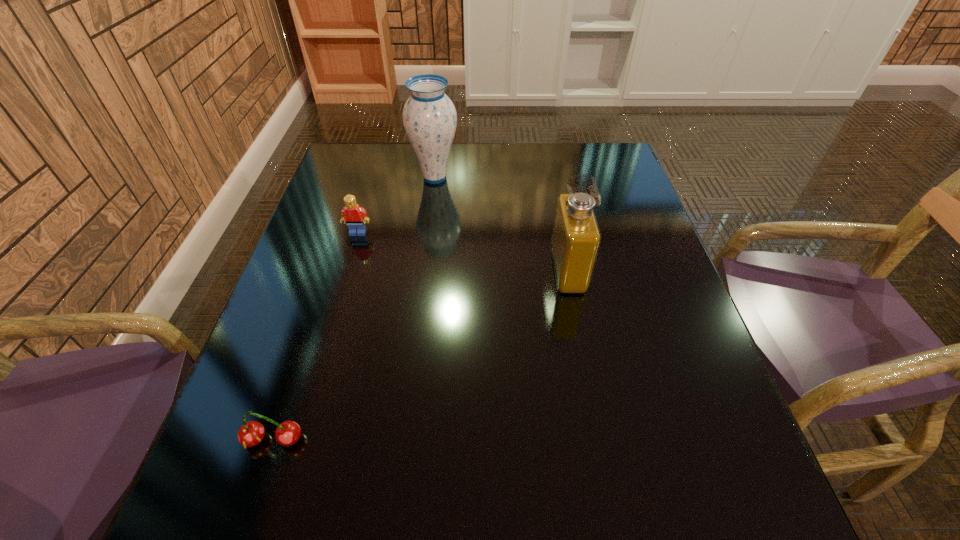
I want to click on the farthest object, so click(429, 117).

Locate an element on the screen. the second object from right to left is located at coordinates (429, 117).

Where is `the second tallest object`? This screenshot has width=960, height=540. the second tallest object is located at coordinates (576, 237).

The height and width of the screenshot is (540, 960). I want to click on perfume, so click(576, 237).

The height and width of the screenshot is (540, 960). I want to click on the third nearest object, so click(352, 213).

Identify the location of the shortest object. The width and height of the screenshot is (960, 540). [250, 434].

Locate an element on the screen. This screenshot has width=960, height=540. the nearest object is located at coordinates (250, 434).

Image resolution: width=960 pixels, height=540 pixels. In order to click on vacant space situated on the front of the farthest object in this screenshot , I will do `click(431, 207)`.

Locate an element on the screen. This screenshot has height=540, width=960. vacant area situated on the front-facing side of the third shortest object is located at coordinates (395, 271).

The height and width of the screenshot is (540, 960). Identify the location of vacant region located 0.380m on the front-facing side of the third shortest object. (386, 271).